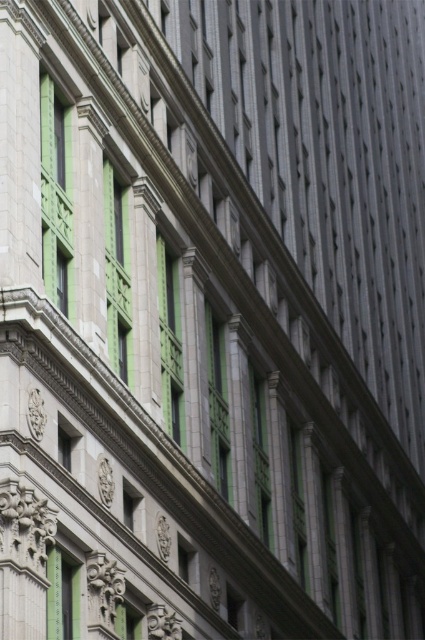
Does green glass window at upper left have a greater width compared to green glass window at center?

No.

The height and width of the screenshot is (640, 425). What do you see at coordinates (54, 195) in the screenshot? I see `green glass window at upper left` at bounding box center [54, 195].

Where is `green glass window at upper left`? green glass window at upper left is located at coordinates pos(54,195).